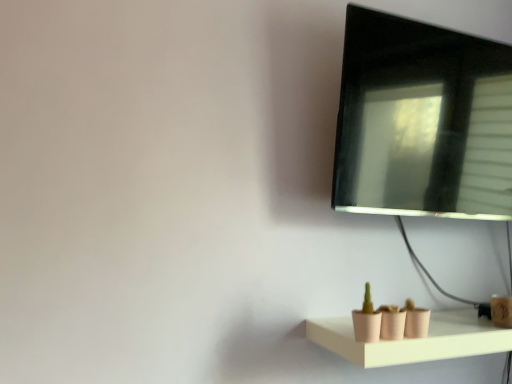
Locate an element on the screen. This screenshot has width=512, height=384. black glossy monitor at upper right is located at coordinates (422, 121).

What do you see at coordinates (422, 121) in the screenshot?
I see `black glossy monitor at upper right` at bounding box center [422, 121].

The image size is (512, 384). Describe the element at coordinates (414, 340) in the screenshot. I see `matte pink shelf at lower right` at that location.

Identify the location of matte pink shelf at lower right. The image size is (512, 384). (414, 340).

In order to face matte pink shelf at lower right, should I rotate leftwards or rightwards?

To face it directly, rotate right by 23.828 degrees.

Measure the distance between matte pink shelf at lower right and camera.

36.96 inches.

Where is `black glossy monitor at upper right`? black glossy monitor at upper right is located at coordinates (422, 121).

Which object is positioned more to the right, matte pink shelf at lower right or black glossy monitor at upper right?

From the viewer's perspective, black glossy monitor at upper right appears more on the right side.

Is the position of matte pink shelf at lower right more distant than that of black glossy monitor at upper right?

No, it is not.

Is point (374, 364) farther from camera compared to point (397, 137)?

No, it is in front of (397, 137).

From the image's perspective, relative to black glossy monitor at upper right, is matte pink shelf at lower right above or below?

Based on their image positions, matte pink shelf at lower right is located beneath black glossy monitor at upper right.

From a real-world perspective, is matte pink shelf at lower right positioned over black glossy monitor at upper right based on gravity?

Incorrect, from a real-world perspective, matte pink shelf at lower right is lower than black glossy monitor at upper right.

Between matte pink shelf at lower right and black glossy monitor at upper right, which one has smaller width?

black glossy monitor at upper right is thinner.

In terms of height, does matte pink shelf at lower right look taller or shorter compared to black glossy monitor at upper right?

Considering their sizes, matte pink shelf at lower right has less height than black glossy monitor at upper right.

Considering the relative sizes of matte pink shelf at lower right and black glossy monitor at upper right in the image provided, is matte pink shelf at lower right bigger than black glossy monitor at upper right?

No.

Is matte pink shelf at lower right inside or outside of black glossy monitor at upper right?

matte pink shelf at lower right is outside black glossy monitor at upper right.

Is matte pink shelf at lower right touching black glossy monitor at upper right?

No, matte pink shelf at lower right is not beside black glossy monitor at upper right.

Could you tell me if matte pink shelf at lower right is facing black glossy monitor at upper right?

No, matte pink shelf at lower right does not turn towards black glossy monitor at upper right.

What's the angular difference between matte pink shelf at lower right and black glossy monitor at upper right's facing directions?

The angle between the facing direction of matte pink shelf at lower right and the facing direction of black glossy monitor at upper right is 1.55 degrees.

Find the location of a particular element. This screenshot has height=384, width=512. computer monitor on the right of matte pink shelf at lower right is located at coordinates (422, 121).

Considering the positions of objects black glossy monitor at upper right and matte pink shelf at lower right in the image provided, who is more to the left, black glossy monitor at upper right or matte pink shelf at lower right?

matte pink shelf at lower right.

Considering their positions, is black glossy monitor at upper right located in front of or behind matte pink shelf at lower right?

In the image, black glossy monitor at upper right appears behind matte pink shelf at lower right.

Is point (453, 157) more distant than point (481, 339)?

That is True.

In the scene shown: From the image's perspective, is black glossy monitor at upper right over matte pink shelf at lower right?

Yes.

From a real-world perspective, who is located higher, black glossy monitor at upper right or matte pink shelf at lower right?

black glossy monitor at upper right is physically above.

Considering the relative sizes of black glossy monitor at upper right and matte pink shelf at lower right in the image provided, is black glossy monitor at upper right wider than matte pink shelf at lower right?

No, black glossy monitor at upper right is not wider than matte pink shelf at lower right.

Which of these two, black glossy monitor at upper right or matte pink shelf at lower right, stands shorter?

matte pink shelf at lower right.

Between black glossy monitor at upper right and matte pink shelf at lower right, which one has smaller size?

Smaller between the two is matte pink shelf at lower right.

Is black glossy monitor at upper right located outside matte pink shelf at lower right?

Yes, black glossy monitor at upper right is outside of matte pink shelf at lower right.

Is black glossy monitor at upper right beside matte pink shelf at lower right?

No, black glossy monitor at upper right is not making contact with matte pink shelf at lower right.

Is black glossy monitor at upper right oriented towards matte pink shelf at lower right?

No, black glossy monitor at upper right is not aimed at matte pink shelf at lower right.

Based on the photo, how different are the orientations of black glossy monitor at upper right and matte pink shelf at lower right in degrees?

There is a 1.55-degree angle between the facing directions of black glossy monitor at upper right and matte pink shelf at lower right.

What are the coordinates of `shelf in front of the black glossy monitor at upper right` in the screenshot? It's located at (414, 340).

Image resolution: width=512 pixels, height=384 pixels. Find the location of `computer monitor above the matte pink shelf at lower right (from a real-world perspective)`. computer monitor above the matte pink shelf at lower right (from a real-world perspective) is located at coordinates (422, 121).

You are a GUI agent. You are given a task and a screenshot of the screen. Output one action in this format:
    pyautogui.click(x=<x>, y=<y>)
    Task: Click on the computer monitor on the right of the matte pink shelf at lower right
    Image resolution: width=512 pixels, height=384 pixels.
    Given the screenshot: What is the action you would take?
    pyautogui.click(x=422, y=121)